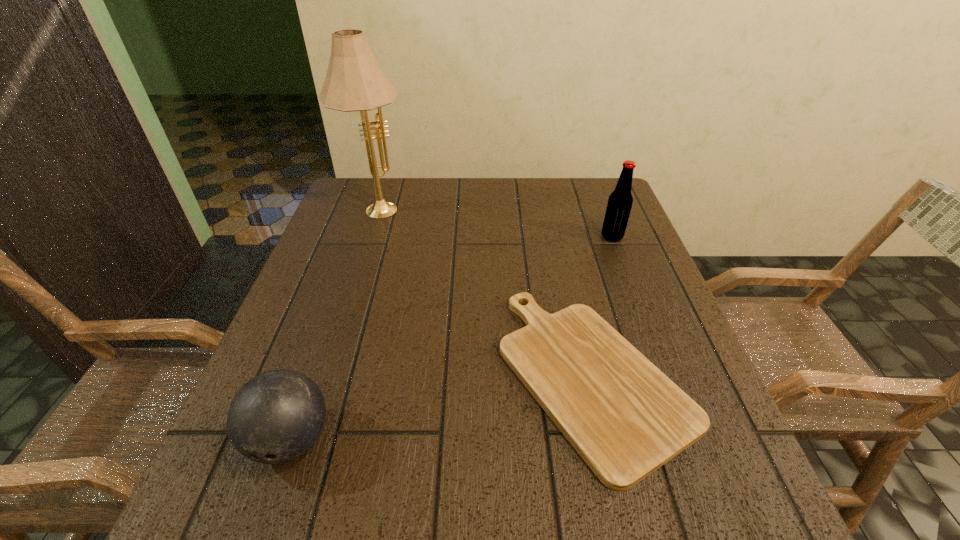
Image resolution: width=960 pixels, height=540 pixels. Identify the location of object located in the far edge section of the desktop. (354, 81).

Find the location of a particular element. The width and height of the screenshot is (960, 540). bowling ball present at the near edge is located at coordinates (275, 417).

Find the location of `chopping board that is at the near edge`. chopping board that is at the near edge is located at coordinates (626, 418).

In order to click on lampshade that is positioned at the left edge in this screenshot , I will do `click(354, 81)`.

This screenshot has width=960, height=540. I want to click on bowling ball that is at the left edge, so (275, 417).

You are a GUI agent. You are given a task and a screenshot of the screen. Output one action in this format:
    pyautogui.click(x=<x>, y=<y>)
    Task: Click on the beer bottle present at the right edge
    The image size is (960, 540).
    Given the screenshot: What is the action you would take?
    pyautogui.click(x=620, y=201)

Where is `chopping board present at the right edge`? The height and width of the screenshot is (540, 960). chopping board present at the right edge is located at coordinates (626, 418).

You are a GUI agent. You are given a task and a screenshot of the screen. Output one action in this format:
    pyautogui.click(x=<x>, y=<y>)
    Task: Click on the object located at the far left corner
    
    Given the screenshot: What is the action you would take?
    pyautogui.click(x=354, y=81)

Image resolution: width=960 pixels, height=540 pixels. What are the coordinates of `object present at the near left corner` in the screenshot? It's located at (275, 417).

Find the location of `object that is positioned at the near right corner`. object that is positioned at the near right corner is located at coordinates (626, 418).